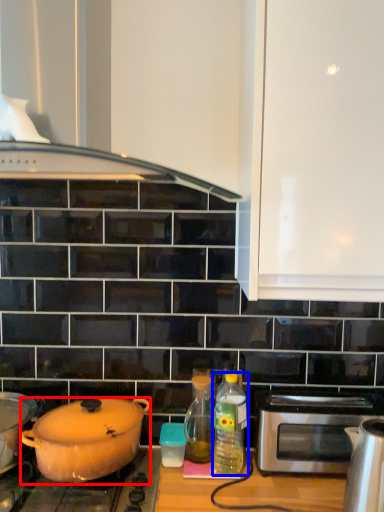
Question: Among these objects, which one is nearest to the camera, kitchen appliance (highlighted by a red box) or bottle (highlighted by a blue box)?

Choices:
 (A) kitchen appliance
 (B) bottle

Answer: (A)